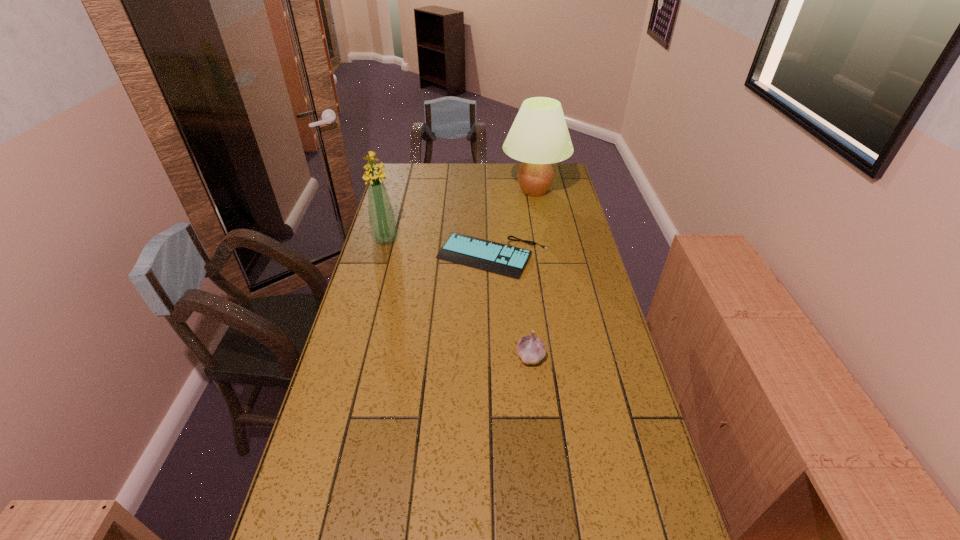
Find the location of `empty space that is in between the farthest object and the leftmost object`. empty space that is in between the farthest object and the leftmost object is located at coordinates (460, 215).

At what (x,y) coordinates should I click in order to perform the action: click on free spot between the nearest object and the leftmost object. Please return your answer as a coordinate pair (x, y). This screenshot has height=540, width=960. Looking at the image, I should click on (458, 298).

The width and height of the screenshot is (960, 540). Identify the location of object that can be found as the closest to the computer keyboard. click(382, 223).

This screenshot has width=960, height=540. In order to click on object that is the third closest to the leftmost object in this screenshot , I will do `click(531, 349)`.

You are a GUI agent. You are given a task and a screenshot of the screen. Output one action in this format:
    pyautogui.click(x=<x>, y=<y>)
    Task: Click on the vacant space that satisfies the following two spatial constraints: 1. on the front-facing side of the leftmost object; 2. on the left side of the nearest object
    The width and height of the screenshot is (960, 540).
    Given the screenshot: What is the action you would take?
    pyautogui.click(x=353, y=356)

Find the location of a particular element. This screenshot has width=960, height=540. vacant region that satisfies the following two spatial constraints: 1. on the front-facing side of the shortest object; 2. on the left side of the leftmost object is located at coordinates (381, 256).

Where is `free spot that satisfies the following two spatial constraints: 1. on the front-facing side of the third tallest object; 2. on the right side of the bouquet`? free spot that satisfies the following two spatial constraints: 1. on the front-facing side of the third tallest object; 2. on the right side of the bouquet is located at coordinates (353, 356).

Locate an element on the screen. This screenshot has height=540, width=960. free spot that satisfies the following two spatial constraints: 1. on the shade of the farthest object; 2. on the front-facing side of the bouquet is located at coordinates (543, 239).

The width and height of the screenshot is (960, 540). In order to click on free region that satisfies the following two spatial constraints: 1. on the shade of the lampshade; 2. on the front side of the nearest object in this screenshot , I will do `click(564, 356)`.

You are a GUI agent. You are given a task and a screenshot of the screen. Output one action in this format:
    pyautogui.click(x=<x>, y=<y>)
    Task: Click on the free location that satisfies the following two spatial constraints: 1. on the shade of the lampshade; 2. on the front side of the nearest object
    The width and height of the screenshot is (960, 540).
    Given the screenshot: What is the action you would take?
    pyautogui.click(x=564, y=356)